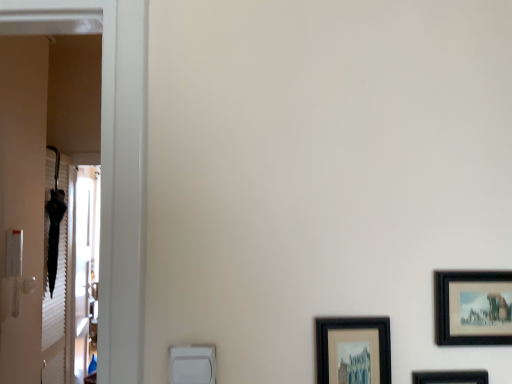
The height and width of the screenshot is (384, 512). What do you see at coordinates (473, 308) in the screenshot?
I see `black matte picture frame at right, arranged as the third picture frame when viewed from the left` at bounding box center [473, 308].

How much space does black matte picture frame at lower right, which is the 1th picture frame from left to right, occupy vertically?

black matte picture frame at lower right, which is the 1th picture frame from left to right, is 7.51 inches tall.

Image resolution: width=512 pixels, height=384 pixels. What do you see at coordinates (353, 350) in the screenshot?
I see `black matte picture frame at lower right, which is the 1th picture frame from left to right` at bounding box center [353, 350].

How much space does black matte picture frame at lower right, which is the second picture frame from left to right, occupy vertically?

black matte picture frame at lower right, which is the second picture frame from left to right, is 18.80 centimeters tall.

What is the approximate width of clear glass screen door at left?

The width of clear glass screen door at left is 18.27 centimeters.

You are a GUI agent. You are given a task and a screenshot of the screen. Output one action in this format:
    pyautogui.click(x=<x>, y=<y>)
    Task: Click on the black matte picture frame at right, arranged as the third picture frame when viewed from the left
    The height and width of the screenshot is (384, 512).
    Given the screenshot: What is the action you would take?
    pyautogui.click(x=473, y=308)

Is there a large distance between clear glass screen door at left and black matte picture frame at lower right, arranged as the 2th picture frame when viewed from the right?

clear glass screen door at left is far away from black matte picture frame at lower right, arranged as the 2th picture frame when viewed from the right.

From the image's perspective, is clear glass screen door at left located above or below black matte picture frame at lower right, arranged as the 2th picture frame when viewed from the right?

clear glass screen door at left is situated lower than black matte picture frame at lower right, arranged as the 2th picture frame when viewed from the right, in the image.

Measure the distance from clear glass screen door at left to black matte picture frame at lower right, which is the second picture frame from left to right.

clear glass screen door at left and black matte picture frame at lower right, which is the second picture frame from left to right, are 2.93 meters apart from each other.

Can you tell me how much clear glass screen door at left and black matte picture frame at lower right, arranged as the 2th picture frame when viewed from the right, differ in facing direction?

clear glass screen door at left and black matte picture frame at lower right, arranged as the 2th picture frame when viewed from the right, are facing 102 degrees away from each other.

Does point (474, 339) come farther from viewer compared to point (471, 382)?

No, it is not.

Which of these two, black matte picture frame at right, arranged as the third picture frame when viewed from the left, or black matte picture frame at lower right, which is the second picture frame from left to right, is bigger?

black matte picture frame at lower right, which is the second picture frame from left to right, is bigger.

From the image's perspective, which picture frame is the 2nd one below the black matte picture frame at right, arranged as the third picture frame when viewed from the left? Please provide its 2D coordinates.

[(450, 377)]

From the image's perspective, between black matte picture frame at right, which is the 1th picture frame in right-to-left order, and black matte picture frame at lower right, which is the second picture frame from left to right, which one is located above?

black matte picture frame at right, which is the 1th picture frame in right-to-left order, from the image's perspective.

Considering the positions of point (448, 372) and point (359, 321), is point (448, 372) closer or farther from the camera than point (359, 321)?

Point (448, 372) appears to be farther away from the viewer than point (359, 321).

Considering the positions of objects black matte picture frame at lower right, arranged as the 2th picture frame when viewed from the right, and black matte picture frame at lower right, which is the 1th picture frame from left to right, in the image provided, who is in front, black matte picture frame at lower right, arranged as the 2th picture frame when viewed from the right, or black matte picture frame at lower right, which is the 1th picture frame from left to right,?

Positioned in front is black matte picture frame at lower right, arranged as the 2th picture frame when viewed from the right.

Based on the photo, from a real-world perspective, which is physically above, black matte picture frame at lower right, arranged as the 2th picture frame when viewed from the right, or black matte picture frame at lower right, the 3th picture frame viewed from the right?

From a 3D spatial view, black matte picture frame at lower right, the 3th picture frame viewed from the right, is above.

Which of these two, black matte picture frame at lower right, which is the second picture frame from left to right, or black matte picture frame at lower right, the 3th picture frame viewed from the right, is wider?

black matte picture frame at lower right, the 3th picture frame viewed from the right.

In the image, is black matte picture frame at right, which is the 1th picture frame in right-to-left order, positioned in front of or behind clear glass screen door at left?

black matte picture frame at right, which is the 1th picture frame in right-to-left order, is in front of clear glass screen door at left.

From the image's perspective, who appears lower, black matte picture frame at right, arranged as the third picture frame when viewed from the left, or clear glass screen door at left?

clear glass screen door at left, from the image's perspective.

Which object is positioned more to the right, black matte picture frame at right, arranged as the third picture frame when viewed from the left, or clear glass screen door at left?

black matte picture frame at right, arranged as the third picture frame when viewed from the left.

Which is in front, point (471, 287) or point (88, 224)?

The point (471, 287) is more forward.

Considering the sizes of objects black matte picture frame at lower right, which is the 1th picture frame from left to right, and black matte picture frame at right, which is the 1th picture frame in right-to-left order, in the image provided, who is taller, black matte picture frame at lower right, which is the 1th picture frame from left to right, or black matte picture frame at right, which is the 1th picture frame in right-to-left order,?

With more height is black matte picture frame at lower right, which is the 1th picture frame from left to right.

From a real-world perspective, is black matte picture frame at lower right, the 3th picture frame viewed from the right, physically below black matte picture frame at right, arranged as the third picture frame when viewed from the left?

Yes.

Is black matte picture frame at lower right, which is the 1th picture frame from left to right, beside black matte picture frame at right, which is the 1th picture frame in right-to-left order?

No, black matte picture frame at lower right, which is the 1th picture frame from left to right, is not next to black matte picture frame at right, which is the 1th picture frame in right-to-left order.

Considering the points (323, 347) and (477, 289), which point is in front, point (323, 347) or point (477, 289)?

Positioned in front is point (323, 347).

Does black matte picture frame at right, which is the 1th picture frame in right-to-left order, appear on the left side of black matte picture frame at lower right, which is the 1th picture frame from left to right?

No.

This screenshot has width=512, height=384. Find the location of `picture frame that appears behind the black matte picture frame at lower right, the 3th picture frame viewed from the right`. picture frame that appears behind the black matte picture frame at lower right, the 3th picture frame viewed from the right is located at coordinates (473, 308).

Considering the sizes of objects black matte picture frame at right, which is the 1th picture frame in right-to-left order, and black matte picture frame at lower right, the 3th picture frame viewed from the right, in the image provided, who is bigger, black matte picture frame at right, which is the 1th picture frame in right-to-left order, or black matte picture frame at lower right, the 3th picture frame viewed from the right,?

black matte picture frame at lower right, the 3th picture frame viewed from the right.

Between black matte picture frame at lower right, which is the 1th picture frame from left to right, and black matte picture frame at lower right, arranged as the 2th picture frame when viewed from the right, which one has less height?

With less height is black matte picture frame at lower right, arranged as the 2th picture frame when viewed from the right.

Considering the sizes of objects black matte picture frame at lower right, which is the 1th picture frame from left to right, and black matte picture frame at lower right, arranged as the 2th picture frame when viewed from the right, in the image provided, who is smaller, black matte picture frame at lower right, which is the 1th picture frame from left to right, or black matte picture frame at lower right, arranged as the 2th picture frame when viewed from the right,?

black matte picture frame at lower right, arranged as the 2th picture frame when viewed from the right, is smaller.

Locate an element on the screen. the 1st picture frame counting from the right of the black matte picture frame at lower right, the 3th picture frame viewed from the right is located at coordinates (450, 377).

Do you think black matte picture frame at lower right, which is the 1th picture frame from left to right, is within black matte picture frame at lower right, which is the second picture frame from left to right, or outside of it?

black matte picture frame at lower right, which is the 1th picture frame from left to right, is outside black matte picture frame at lower right, which is the second picture frame from left to right.

The width and height of the screenshot is (512, 384). I want to click on the 1st picture frame positioned above the clear glass screen door at left (from a real-world perspective), so click(x=450, y=377).

Find the location of a particular element. This screenshot has width=512, height=384. picture frame that is the 2nd one when counting forward from the black matte picture frame at right, arranged as the third picture frame when viewed from the left is located at coordinates (450, 377).

From the image, which object appears to be nearer to black matte picture frame at lower right, arranged as the 2th picture frame when viewed from the right, black matte picture frame at right, arranged as the third picture frame when viewed from the left, or black matte picture frame at lower right, the 3th picture frame viewed from the right?

Among the two, black matte picture frame at right, arranged as the third picture frame when viewed from the left, is located nearer to black matte picture frame at lower right, arranged as the 2th picture frame when viewed from the right.

When comparing their distances from black matte picture frame at lower right, which is the 1th picture frame from left to right, does black matte picture frame at lower right, which is the second picture frame from left to right, or black matte picture frame at right, arranged as the third picture frame when viewed from the left, seem closer?

Based on the image, black matte picture frame at lower right, which is the second picture frame from left to right, appears to be nearer to black matte picture frame at lower right, which is the 1th picture frame from left to right.

Estimate the real-world distances between objects in this image. Which object is closer to black matte picture frame at lower right, arranged as the 2th picture frame when viewed from the right, black matte picture frame at lower right, which is the 1th picture frame from left to right, or clear glass screen door at left?

black matte picture frame at lower right, which is the 1th picture frame from left to right, is closer to black matte picture frame at lower right, arranged as the 2th picture frame when viewed from the right.

Based on their spatial positions, is clear glass screen door at left or black matte picture frame at right, which is the 1th picture frame in right-to-left order, further from black matte picture frame at lower right, which is the 1th picture frame from left to right?

clear glass screen door at left is further to black matte picture frame at lower right, which is the 1th picture frame from left to right.

From the image, which object appears to be nearer to black matte picture frame at right, arranged as the third picture frame when viewed from the left, black matte picture frame at lower right, arranged as the 2th picture frame when viewed from the right, or black matte picture frame at lower right, the 3th picture frame viewed from the right?

black matte picture frame at lower right, arranged as the 2th picture frame when viewed from the right.

Based on their spatial positions, is black matte picture frame at lower right, arranged as the 2th picture frame when viewed from the right, or black matte picture frame at right, which is the 1th picture frame in right-to-left order, closer to clear glass screen door at left?

black matte picture frame at right, which is the 1th picture frame in right-to-left order.

Based on their spatial positions, is black matte picture frame at lower right, arranged as the 2th picture frame when viewed from the right, or black matte picture frame at lower right, the 3th picture frame viewed from the right, closer to clear glass screen door at left?

Based on the image, black matte picture frame at lower right, the 3th picture frame viewed from the right, appears to be nearer to clear glass screen door at left.

Which object lies further to the anchor point black matte picture frame at right, arranged as the third picture frame when viewed from the left, black matte picture frame at lower right, which is the 1th picture frame from left to right, or black matte picture frame at lower right, arranged as the 2th picture frame when viewed from the right?

Based on the image, black matte picture frame at lower right, which is the 1th picture frame from left to right, appears to be further to black matte picture frame at right, arranged as the third picture frame when viewed from the left.

The image size is (512, 384). Identify the location of picture frame located between black matte picture frame at lower right, the 3th picture frame viewed from the right, and black matte picture frame at right, which is the 1th picture frame in right-to-left order, in the left-right direction. (450, 377).

The image size is (512, 384). What are the coordinates of `picture frame between black matte picture frame at lower right, which is the 1th picture frame from left to right, and clear glass screen door at left in the front-back direction` in the screenshot? It's located at (473, 308).